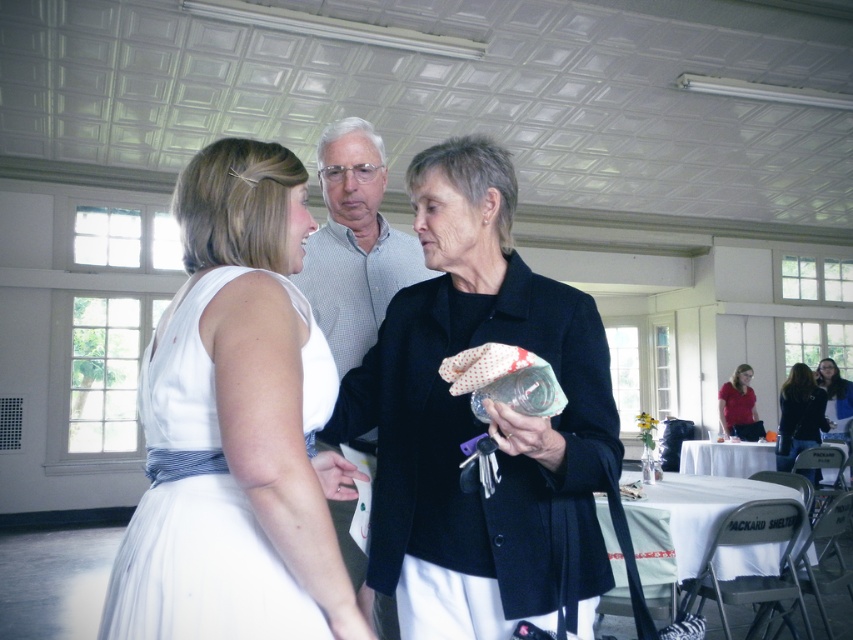
You are standing in the room and want to place a new decorative item on the floor. The item requires a space that is not occupied by any objects listed. Can you place it near the matte black jacket at center?

The matte black jacket at center is located at point (476, 420), so yes, you can place the decorative item near it as long as the space is unoccupied.